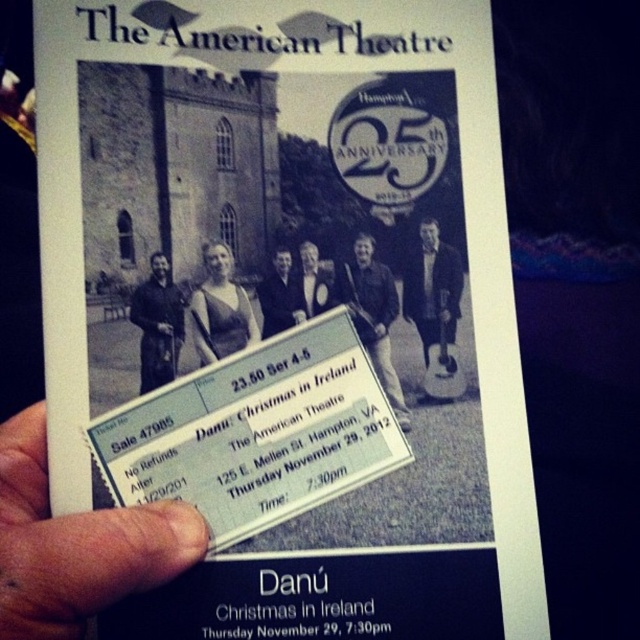
Question: Does matte black guitar at center have a lesser width compared to dark blue suit at center?

Choices:
 (A) no
 (B) yes

Answer: (A)

Question: Which point is closer to the camera taking this photo?

Choices:
 (A) (60, 557)
 (B) (220, 310)
 (C) (272, 300)

Answer: (A)

Question: Which object is farther from the camera taking this photo?

Choices:
 (A) dark brown leather jacket at left
 (B) dark blue suit at center
 (C) matte black dress at center
 (D) matte black guitar at center

Answer: (D)

Question: Does black leather jacket at center have a smaller size compared to dark blue suit at center?

Choices:
 (A) no
 (B) yes

Answer: (A)

Question: Estimate the real-world distances between objects in this image. Which object is farther from the dark blue suit at center?

Choices:
 (A) flesh-toned skin at lower left
 (B) black leather jacket at center

Answer: (A)

Question: Can you confirm if flesh-toned skin at lower left is positioned above black leather jacket at center?

Choices:
 (A) yes
 (B) no

Answer: (B)